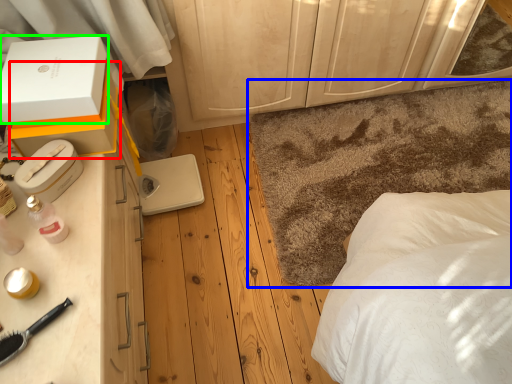
Question: Which object is the closest to the box (highlighted by a red box)? Choose among these: mat (highlighted by a blue box) or box (highlighted by a green box).

Choices:
 (A) mat
 (B) box

Answer: (B)